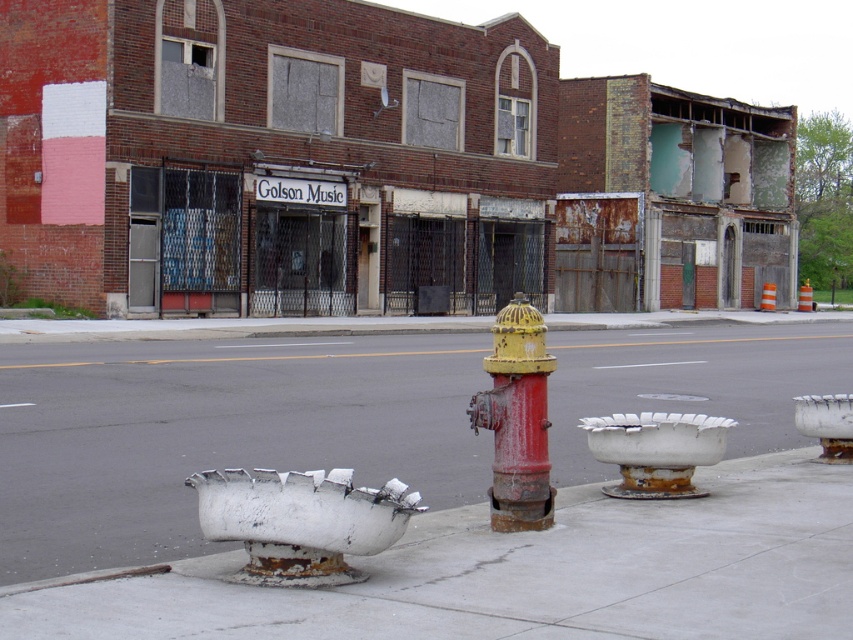
Which is in front, point (602, 368) or point (277, 576)?

Point (277, 576)

Does white concrete pavement at center appear on the right side of white rusted metal planter at lower left?

No, white concrete pavement at center is not to the right of white rusted metal planter at lower left.

Does point (51, 547) lie behind point (317, 474)?

That is True.

Identify the location of white concrete pavement at center. The height and width of the screenshot is (640, 853). (216, 433).

Find the location of a particular element. white concrete pavement at center is located at coordinates (216, 433).

Which is behind, point (122, 560) or point (471, 410)?

The point (471, 410) is behind.

I want to click on white concrete pavement at center, so click(x=216, y=433).

The image size is (853, 640). I want to click on white concrete pavement at center, so click(216, 433).

Can you confirm if white rusted pavement at center is positioned to the left of white rusted metal planter at lower left?

In fact, white rusted pavement at center is to the right of white rusted metal planter at lower left.

Image resolution: width=853 pixels, height=640 pixels. Describe the element at coordinates (521, 573) in the screenshot. I see `white rusted pavement at center` at that location.

Between point (477, 520) and point (351, 493), which one is positioned in front?

Point (351, 493) is in front.

Where is `white rusted pavement at center`? white rusted pavement at center is located at coordinates (521, 573).